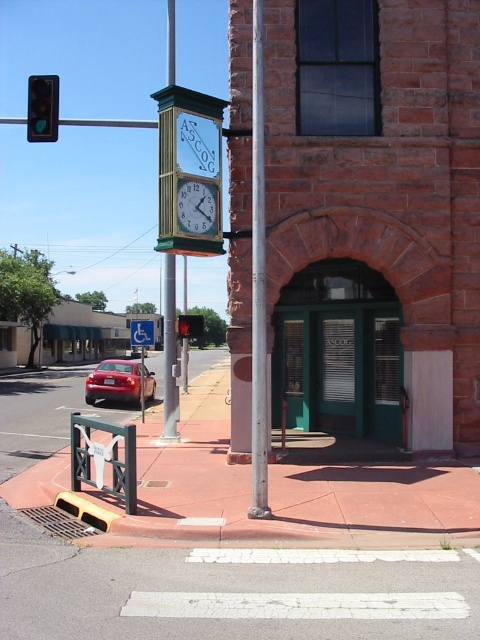
You are a delivery driver approaching the street corner with a truck that is 2 meters wide. You see the shiny red sedan at lower left and the green wooden clock at center. Can your truck pass between them without hitting either?

The shiny red sedan at lower left is wider than the green wooden clock at center. Since the truck is 2 meters wide, you need to check the distance between the two objects. If the space between them is at least 2 meters, the truck can pass safely. However, without knowing the exact distance, it is uncertain. Please measure the space before proceeding.

You are a delivery driver approaching the historic brick building with a green door. You need to park your truck near the green wooden clock at center and the blue plastic handicap sign at center. Which object should you park closer to if you want to be as close as possible to both without choosing one over the other?

The green wooden clock at center is shorter than the blue plastic handicap sign at center. To park as close as possible to both without favoring one, position your truck between them, closer to the shorter green wooden clock at center to balance the distance.

You are a delivery driver approaching the ASCOG building and need to park your shiny red sedan at lower left. The parking spot has a maximum length of 15 feet. Can you fit your vehicle in the spot?

The shiny red sedan at lower left is 15 feet long, so it can fit in the parking spot with the maximum length of 15 feet.